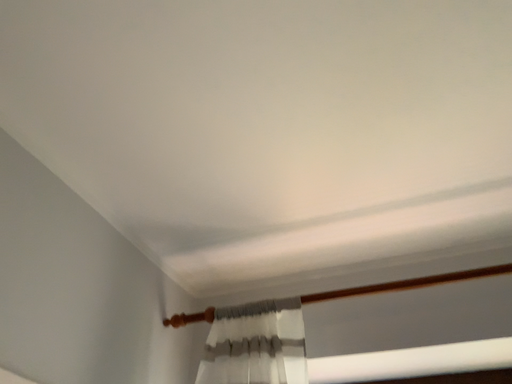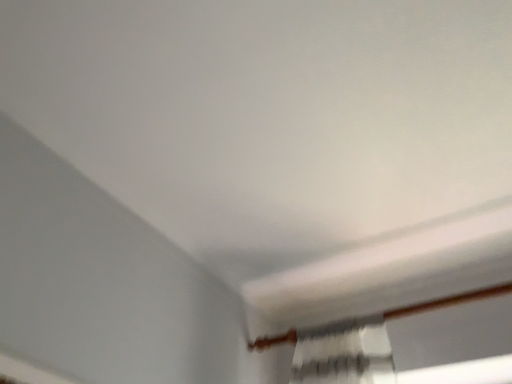
Question: How did the camera likely rotate when shooting the video?

Choices:
 (A) rotated left
 (B) rotated right

Answer: (A)